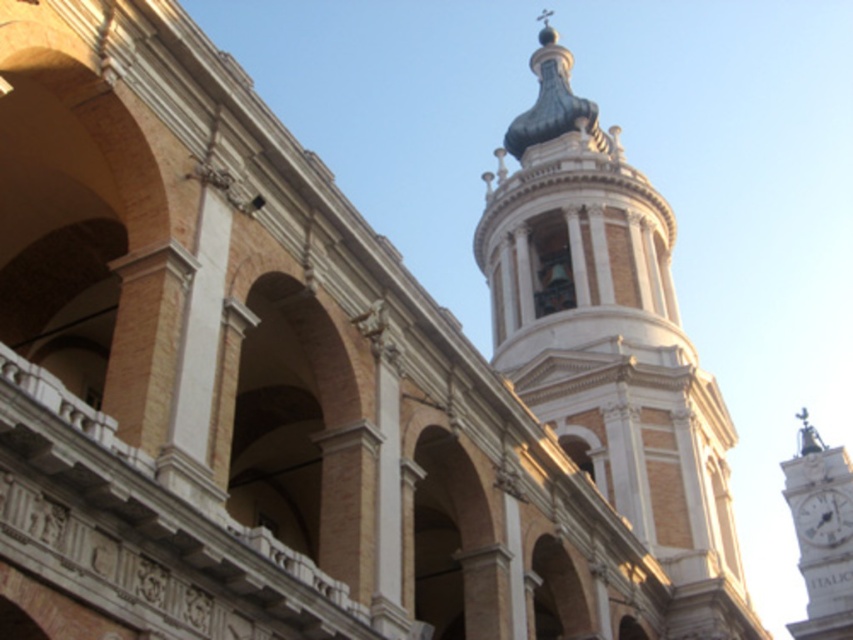
Question: Considering the real-world distances, which object is closest to the white glossy clock at upper right?

Choices:
 (A) white marble clock tower at right
 (B) white marble bell tower at upper center

Answer: (A)

Question: Does white marble bell tower at upper center appear on the left side of white marble clock tower at right?

Choices:
 (A) yes
 (B) no

Answer: (A)

Question: Observing the image, what is the correct spatial positioning of white marble clock tower at right in reference to white glossy clock at upper right?

Choices:
 (A) below
 (B) above

Answer: (B)

Question: Among these points, which one is farthest from the camera?

Choices:
 (A) (596, 179)
 (B) (813, 490)

Answer: (A)

Question: Which point is closer to the camera taking this photo?

Choices:
 (A) (799, 556)
 (B) (706, 483)
 (C) (837, 545)

Answer: (B)

Question: From the image, what is the correct spatial relationship of white marble bell tower at upper center in relation to white marble clock tower at right?

Choices:
 (A) below
 (B) above

Answer: (B)